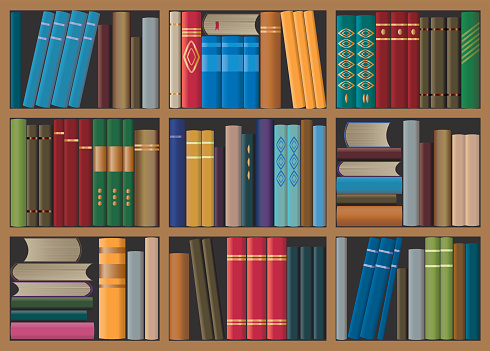
Locate an element on the screen. The width and height of the screenshot is (490, 351). horizontally stacked books on bottom shelf is located at coordinates (54, 252), (57, 271), (58, 286), (61, 303), (60, 314), (59, 329).